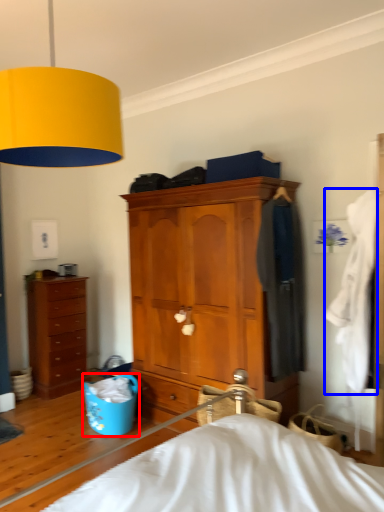
Question: Which point is further to the camera, laundry basket (highlighted by a red box) or clothing (highlighted by a blue box)?

Choices:
 (A) laundry basket
 (B) clothing

Answer: (A)